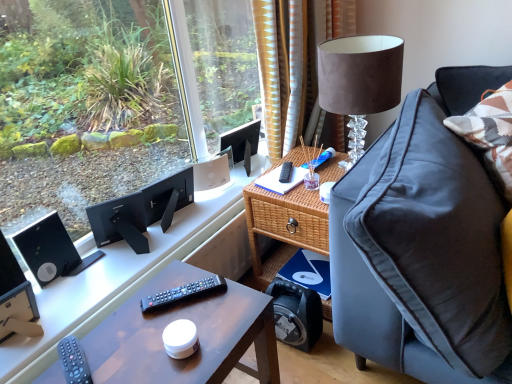
Locate an element on the screen. The width and height of the screenshot is (512, 384). free space above matte black desk at center (from a real-world perspective) is located at coordinates (158, 325).